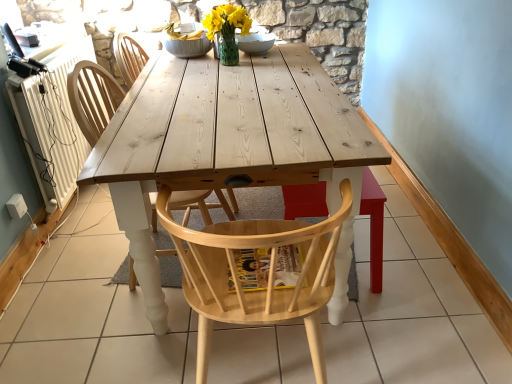
Question: In the image, is natural wood chair at center, the 1th chair when ordered from back to front, on the left side or the right side of natural wood chair at center, the second chair when ordered from front to back?

Choices:
 (A) right
 (B) left

Answer: (A)

Question: Considering the positions of point (122, 54) and point (75, 92), is point (122, 54) closer or farther from the camera than point (75, 92)?

Choices:
 (A) farther
 (B) closer

Answer: (A)

Question: Estimate the real-world distances between objects in this image. Which object is closer to the polka dot glass vase at center?

Choices:
 (A) natural wood chair at center, which ranks as the first chair in front-to-back order
 (B) white ceramic bowl at center
 (C) natural wood chair at center, the second chair when ordered from front to back
 (D) natural wood chair at center, the 3th chair viewed from the front

Answer: (B)

Question: Which of these objects is positioned farthest from the polka dot glass vase at center?

Choices:
 (A) natural wood chair at center, which ranks as the first chair in front-to-back order
 (B) white ceramic bowl at center
 (C) natural wood chair at center, the 2th chair viewed from the back
 (D) natural wood chair at center, the 3th chair viewed from the front

Answer: (A)